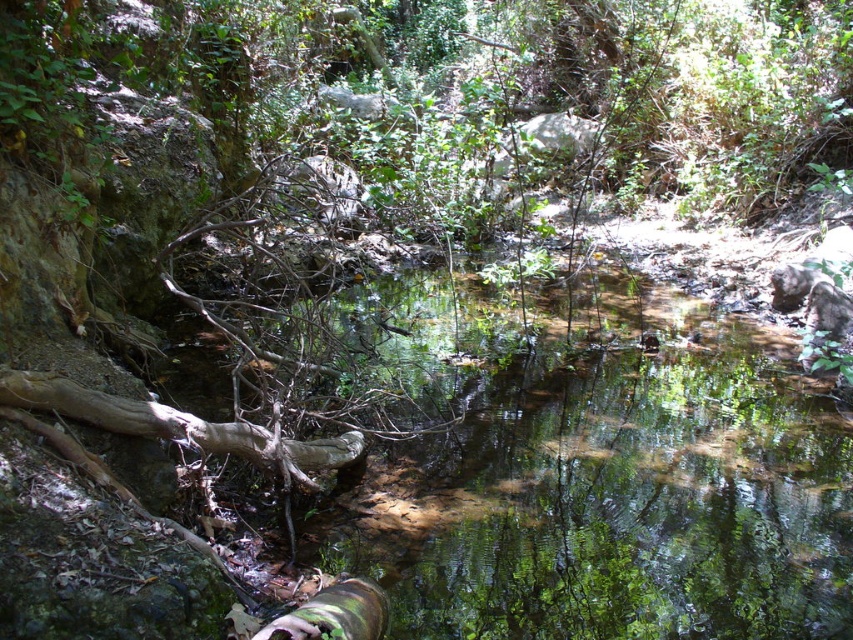
Question: Which object is positioned closest to the brown rough tree trunk at lower left?

Choices:
 (A) clear water at center
 (B) green mossy log at center

Answer: (B)

Question: Does clear water at center appear over green mossy log at center?

Choices:
 (A) no
 (B) yes

Answer: (B)

Question: Estimate the real-world distances between objects in this image. Which object is farther from the clear water at center?

Choices:
 (A) green mossy log at center
 (B) brown rough tree trunk at lower left

Answer: (B)

Question: Can you confirm if clear water at center is bigger than green mossy log at center?

Choices:
 (A) no
 (B) yes

Answer: (B)

Question: Does clear water at center have a lesser width compared to brown rough tree trunk at lower left?

Choices:
 (A) yes
 (B) no

Answer: (B)

Question: Which point appears closest to the camera in this image?

Choices:
 (A) (351, 605)
 (B) (103, 413)
 (C) (376, 465)

Answer: (A)